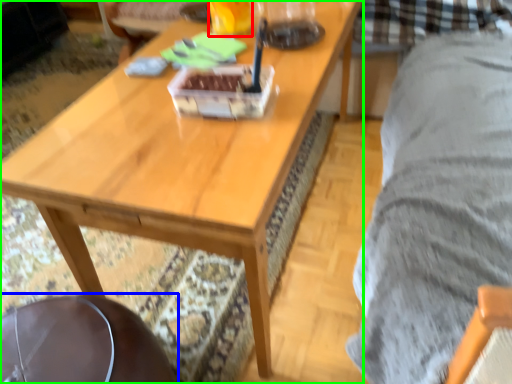
Question: Estimate the real-world distances between objects in this image. Which object is closer to beverage (highlighted by a red box), swivel chair (highlighted by a blue box) or coffee table (highlighted by a green box)?

Choices:
 (A) swivel chair
 (B) coffee table

Answer: (B)